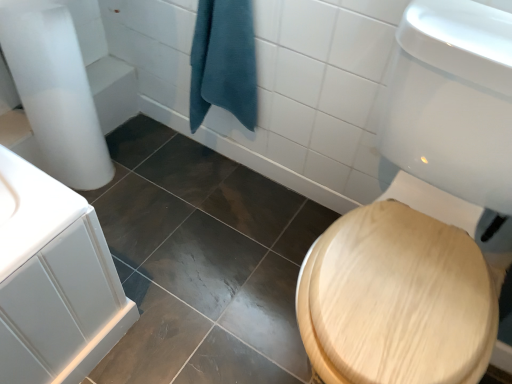
Question: Should I look upward or downward to see teal cotton towel at center?

Choices:
 (A) up
 (B) down

Answer: (A)

Question: Is wooden at right in front of teal cotton towel at center?

Choices:
 (A) no
 (B) yes

Answer: (B)

Question: Can you confirm if wooden at right is wider than teal cotton towel at center?

Choices:
 (A) no
 (B) yes

Answer: (B)

Question: Can you confirm if wooden at right is thinner than teal cotton towel at center?

Choices:
 (A) no
 (B) yes

Answer: (A)

Question: Is wooden at right at the left side of teal cotton towel at center?

Choices:
 (A) yes
 (B) no

Answer: (B)

Question: Is wooden at right outside of teal cotton towel at center?

Choices:
 (A) no
 (B) yes

Answer: (B)

Question: Is wooden at right smaller than teal cotton towel at center?

Choices:
 (A) no
 (B) yes

Answer: (A)

Question: From a real-world perspective, is teal cotton towel at center physically above wooden at right?

Choices:
 (A) yes
 (B) no

Answer: (A)

Question: Is wooden at right located within teal cotton towel at center?

Choices:
 (A) no
 (B) yes

Answer: (A)

Question: Would you say teal cotton towel at center is a long distance from wooden at right?

Choices:
 (A) yes
 (B) no

Answer: (B)

Question: Is teal cotton towel at center positioned behind wooden at right?

Choices:
 (A) yes
 (B) no

Answer: (A)

Question: Considering the relative sizes of teal cotton towel at center and wooden at right in the image provided, is teal cotton towel at center smaller than wooden at right?

Choices:
 (A) no
 (B) yes

Answer: (B)

Question: Are teal cotton towel at center and wooden at right beside each other?

Choices:
 (A) no
 (B) yes

Answer: (A)

Question: From the image's perspective, is teal cotton towel at center located above or below wooden at right?

Choices:
 (A) above
 (B) below

Answer: (A)